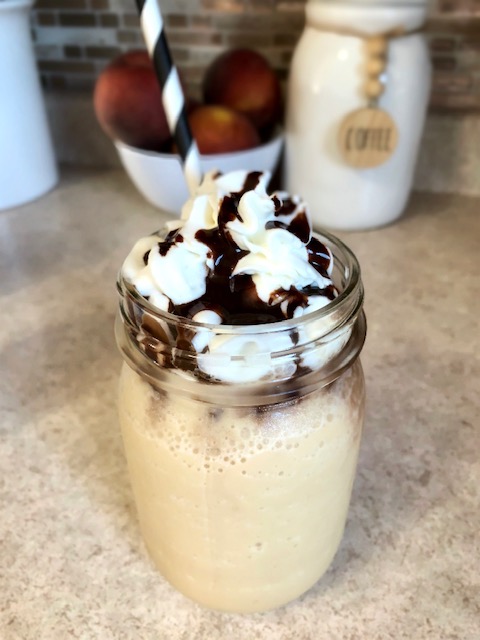
The width and height of the screenshot is (480, 640). I want to click on glass, so click(x=266, y=451).